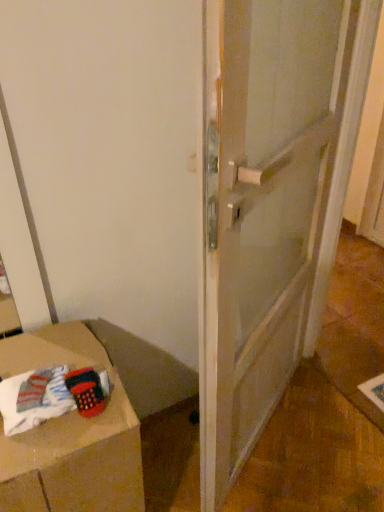
Question: Based on their positions, is knitted fabric basket at lower left located to the left or right of transparent glass door at center?

Choices:
 (A) right
 (B) left

Answer: (B)

Question: From the image's perspective, is knitted fabric basket at lower left located above or below transparent glass door at center?

Choices:
 (A) below
 (B) above

Answer: (A)

Question: Estimate the real-world distances between objects in this image. Which object is closer to the transparent glass door at center?

Choices:
 (A) white soft fabric at lower left
 (B) knitted fabric basket at lower left

Answer: (B)

Question: Estimate the real-world distances between objects in this image. Which object is closer to the white soft fabric at lower left?

Choices:
 (A) knitted fabric basket at lower left
 (B) transparent glass door at center

Answer: (A)